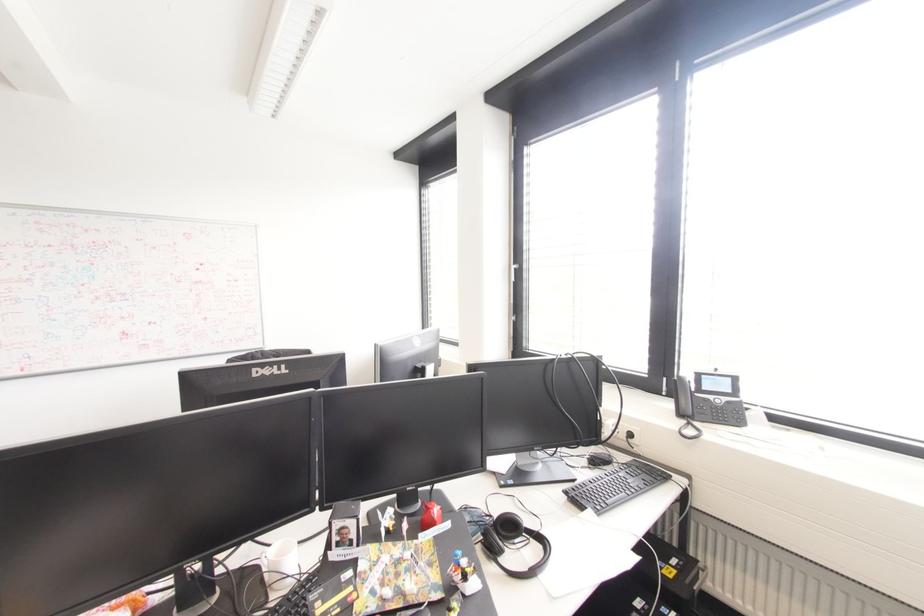
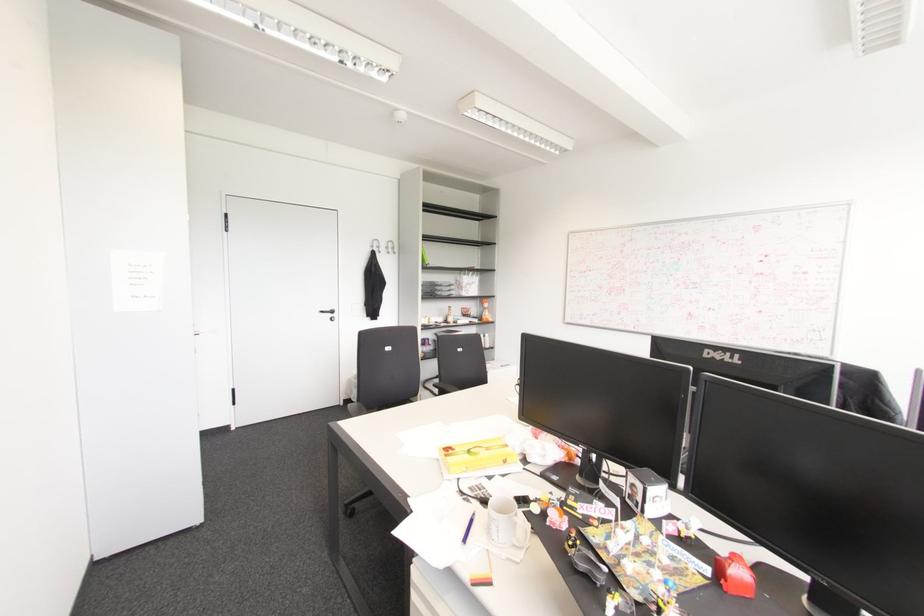
Question: How did the camera likely rotate?

Choices:
 (A) Left
 (B) Right
 (C) Up
 (D) Down

Answer: (A)